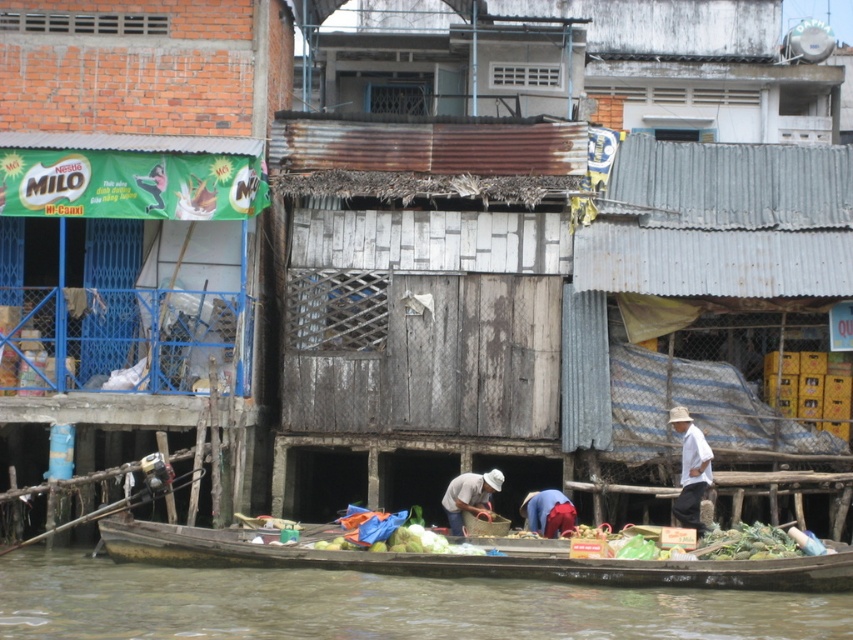
Question: Does brown wooden boat at lower center appear on the left side of red fabric at lower center?

Choices:
 (A) yes
 (B) no

Answer: (A)

Question: Does rusty corrugated metal hut at center have a larger size compared to matte white hat at center?

Choices:
 (A) no
 (B) yes

Answer: (B)

Question: Observing the image, what is the correct spatial positioning of matte white hat at center in reference to red fabric at lower center?

Choices:
 (A) below
 (B) above

Answer: (B)

Question: Which object is positioned closest to the green leafy vegetables at center?

Choices:
 (A) red fabric at lower center
 (B) wooden canoe at lower center

Answer: (B)

Question: Which point is closer to the camera?

Choices:
 (A) green leafy vegetables at center
 (B) brown wooden boat at lower center
 (C) matte white hat at center

Answer: (B)

Question: Among these points, which one is farthest from the camera?

Choices:
 (A) (534, 496)
 (B) (242, 429)
 (C) (488, 502)
 (D) (788, 552)

Answer: (A)